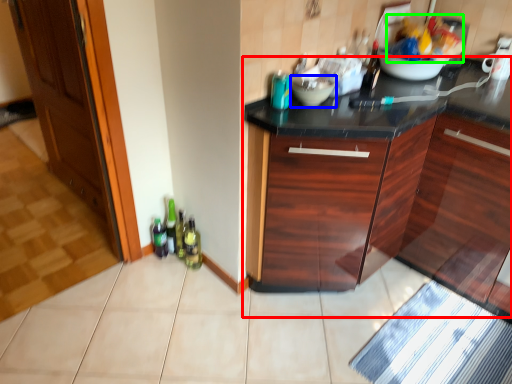
Question: Which is nearer to the cabinetry (highlighted by a red box)? mixing bowl (highlighted by a blue box) or food (highlighted by a green box).

Choices:
 (A) mixing bowl
 (B) food

Answer: (B)